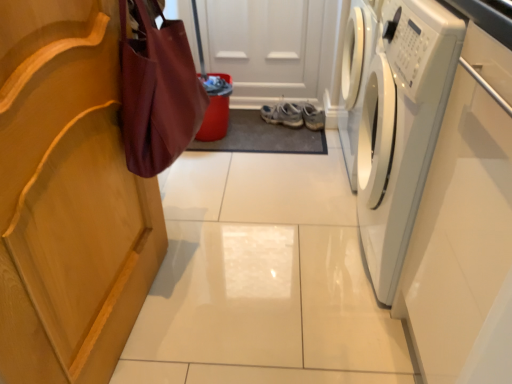
At what (x,y) coordinates should I click in order to perform the action: click on free space in front of light blue fabric sneakers at center. Please return your answer as a coordinate pair (x, y). The width and height of the screenshot is (512, 384). Looking at the image, I should click on (289, 136).